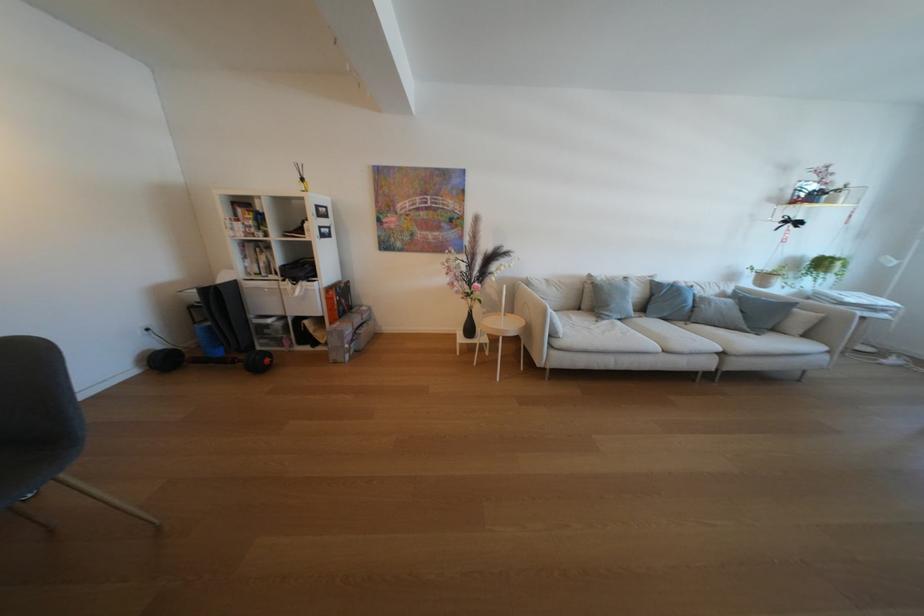
What are the coordinates of `grey chair sitting surface` in the screenshot? It's located at (27, 460).